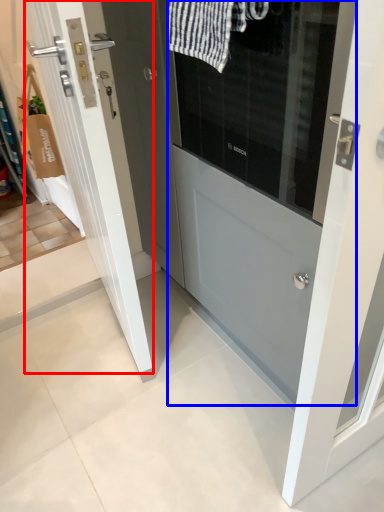
Question: Which object is further to the camera taking this photo, door (highlighted by a red box) or door (highlighted by a blue box)?

Choices:
 (A) door
 (B) door

Answer: (A)